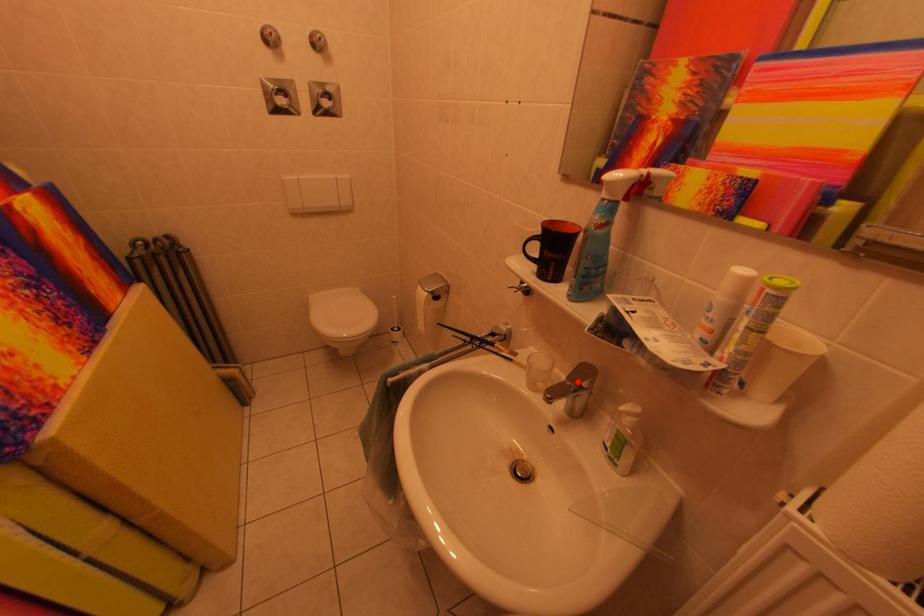
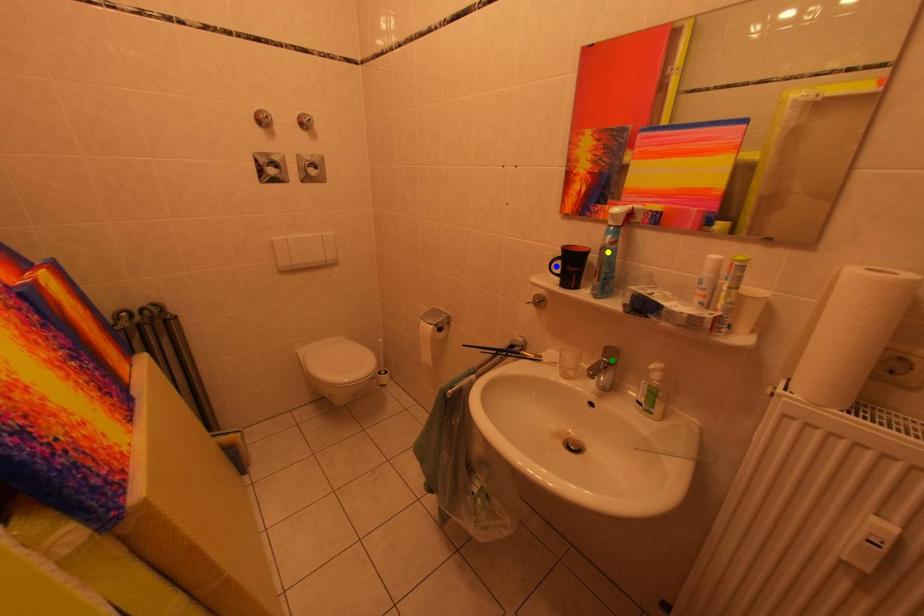
Question: I am providing you with two images of the same scene from different viewpoints. A red point is marked on the first image. You are given multiple points on the second image. In image 2, which mark is for the same physical point as the one in image 1?

Choices:
 (A) yellow point
 (B) blue point
 (C) green point

Answer: (C)